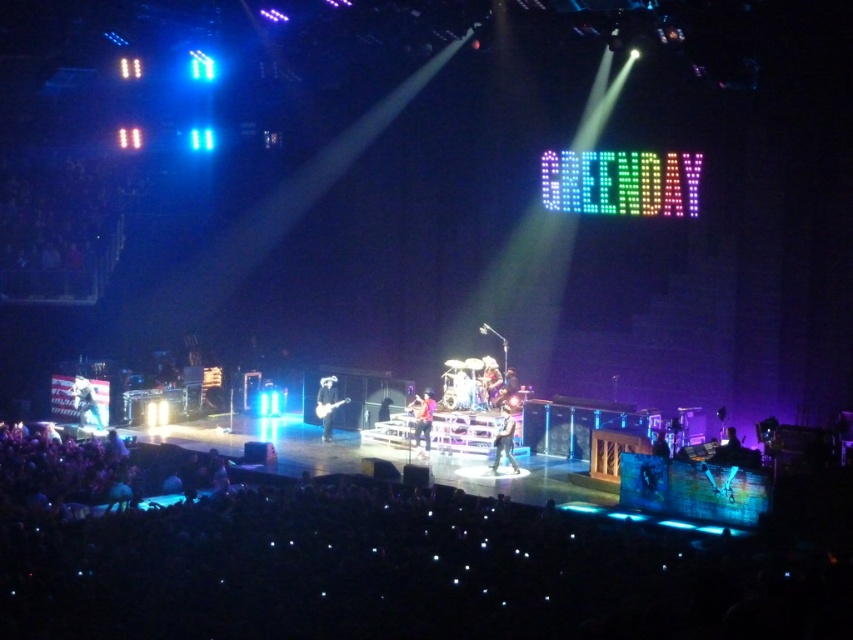
Question: Which point is farther from the camera taking this photo?

Choices:
 (A) (322, 429)
 (B) (509, 412)

Answer: (A)

Question: Which point is farther to the camera?

Choices:
 (A) reddish-brown leather guitar at center
 (B) black fabric crowd at lower center
 (C) matte black guitar at center

Answer: (C)

Question: Does black fabric crowd at lower center appear on the right side of reddish-brown leather guitar at center?

Choices:
 (A) no
 (B) yes

Answer: (A)

Question: Is black fabric crowd at lower center closer to camera compared to denim jacket at center?

Choices:
 (A) no
 (B) yes

Answer: (B)

Question: Is black fabric crowd at lower center thinner than denim jacket at center?

Choices:
 (A) yes
 (B) no

Answer: (B)

Question: Which of the following is the farthest from the observer?

Choices:
 (A) (506, 445)
 (B) (316, 404)
 (C) (398, 564)

Answer: (B)